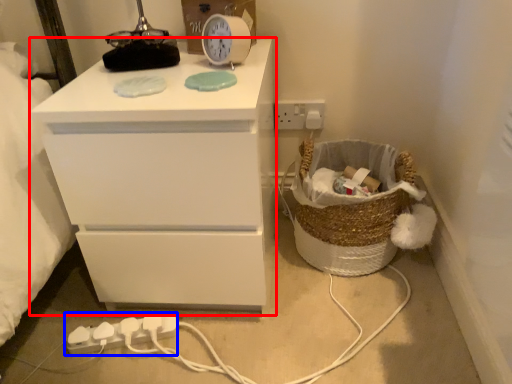
Question: Which object is closer to the camera taking this photo, chest of drawers (highlighted by a red box) or extension cord (highlighted by a blue box)?

Choices:
 (A) chest of drawers
 (B) extension cord

Answer: (A)